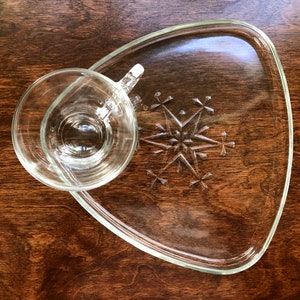
Where is `wood surface`? The height and width of the screenshot is (300, 300). wood surface is located at coordinates (65, 265).